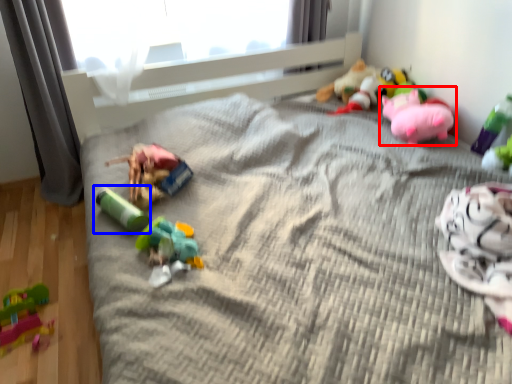
Question: Which point is further to the camera, toy (highlighted by a red box) or toy (highlighted by a blue box)?

Choices:
 (A) toy
 (B) toy

Answer: (A)